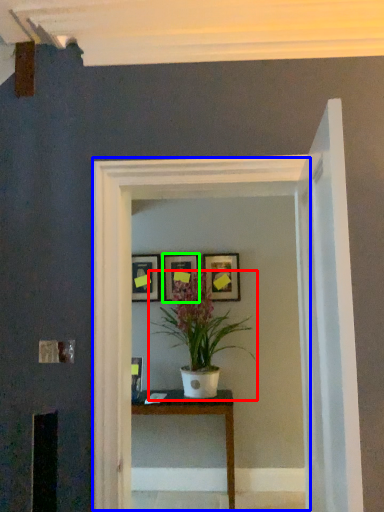
Question: Which is nearer to the houseplant (highlighted by a red box)? glass door (highlighted by a blue box) or picture frame (highlighted by a green box).

Choices:
 (A) glass door
 (B) picture frame

Answer: (B)